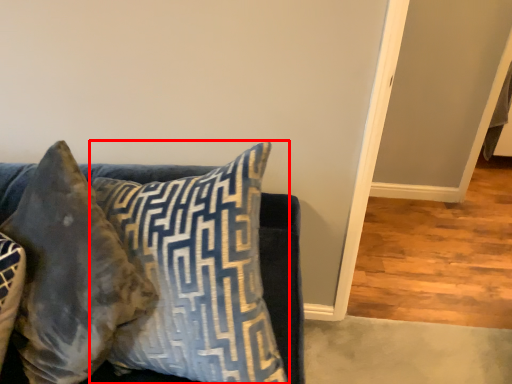
Question: From the image's perspective, what is the correct spatial relationship of pillow (annotated by the red box) in relation to pillow?

Choices:
 (A) below
 (B) above

Answer: (B)